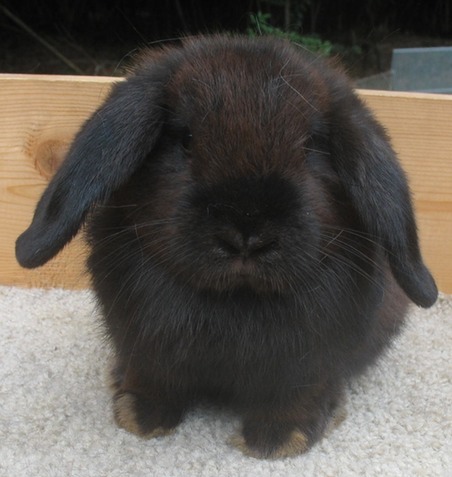
Where is `wooden board`? wooden board is located at coordinates (36, 117), (68, 269), (434, 223), (420, 120).